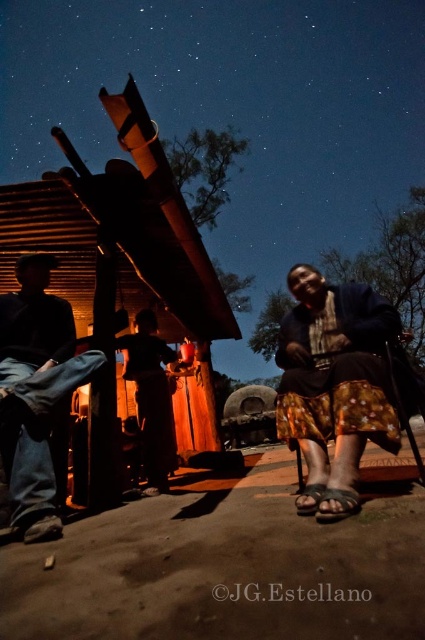
Question: Can you confirm if printed fabric skirt at lower right is bigger than brushed metal pants at lower left?

Choices:
 (A) yes
 (B) no

Answer: (B)

Question: Which object is closer to the camera taking this photo?

Choices:
 (A) brushed metal pants at lower left
 (B) printed fabric skirt at lower right

Answer: (B)

Question: Which of the following is the farthest from the observer?

Choices:
 (A) printed fabric skirt at lower right
 (B) brushed metal pants at lower left

Answer: (B)

Question: Does printed fabric skirt at lower right appear under brushed metal pants at lower left?

Choices:
 (A) yes
 (B) no

Answer: (A)

Question: Is printed fabric skirt at lower right above brushed metal pants at lower left?

Choices:
 (A) no
 (B) yes

Answer: (A)

Question: Among these points, which one is nearest to the camera?

Choices:
 (A) (87, 378)
 (B) (334, 429)

Answer: (B)